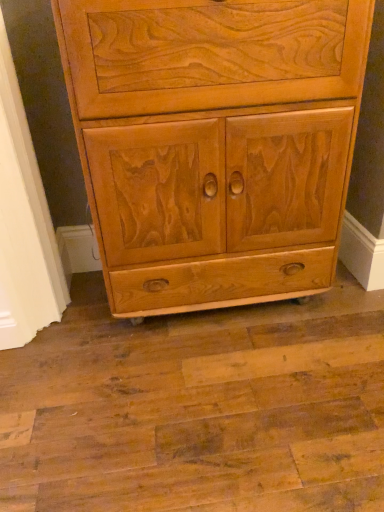
Question: Does matte wood cabinet at lower left come behind matte wood cabinet at center?

Choices:
 (A) no
 (B) yes

Answer: (B)

Question: Is matte wood cabinet at lower left positioned with its back to matte wood cabinet at center?

Choices:
 (A) no
 (B) yes

Answer: (A)

Question: Does matte wood cabinet at lower left have a greater height compared to matte wood cabinet at center?

Choices:
 (A) no
 (B) yes

Answer: (B)

Question: From the image's perspective, is matte wood cabinet at lower left over matte wood cabinet at center?

Choices:
 (A) yes
 (B) no

Answer: (B)

Question: Considering the relative sizes of matte wood cabinet at lower left and matte wood cabinet at center in the image provided, is matte wood cabinet at lower left bigger than matte wood cabinet at center?

Choices:
 (A) no
 (B) yes

Answer: (A)

Question: Is matte wood cabinet at lower left at the right side of matte wood cabinet at center?

Choices:
 (A) no
 (B) yes

Answer: (A)

Question: Does matte wood cabinet at center have a greater width compared to matte wood cabinet at lower left?

Choices:
 (A) no
 (B) yes

Answer: (B)

Question: Is matte wood cabinet at center oriented away from matte wood cabinet at lower left?

Choices:
 (A) yes
 (B) no

Answer: (B)

Question: Is matte wood cabinet at center located outside matte wood cabinet at lower left?

Choices:
 (A) yes
 (B) no

Answer: (A)

Question: Does matte wood cabinet at center appear on the left side of matte wood cabinet at lower left?

Choices:
 (A) yes
 (B) no

Answer: (B)

Question: From a real-world perspective, is matte wood cabinet at center on matte wood cabinet at lower left?

Choices:
 (A) no
 (B) yes

Answer: (A)

Question: Is matte wood cabinet at center facing towards matte wood cabinet at lower left?

Choices:
 (A) yes
 (B) no

Answer: (B)

Question: In the image, is matte wood cabinet at center on the left side or the right side of matte wood cabinet at lower left?

Choices:
 (A) right
 (B) left

Answer: (A)